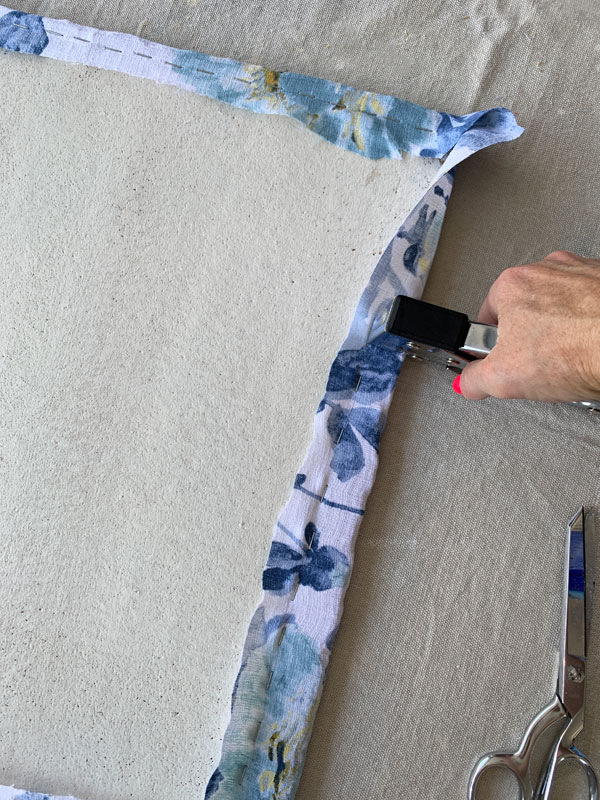
At what (x,y) coordinates should I click in order to perform the action: click on white cloth. Please return your answer as a coordinate pair (x, y). The width and height of the screenshot is (600, 800). Looking at the image, I should click on pos(60,48).